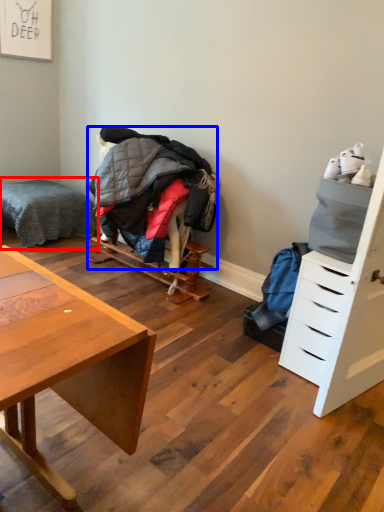
Question: Which point is closer to the camera, bed (highlighted by a red box) or clothing (highlighted by a blue box)?

Choices:
 (A) bed
 (B) clothing

Answer: (B)